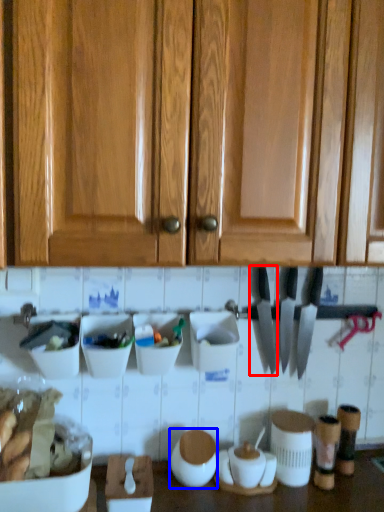
Question: Which of the following is the closest to the observer, knife (highlighted by a red box) or appliance (highlighted by a blue box)?

Choices:
 (A) knife
 (B) appliance

Answer: (B)